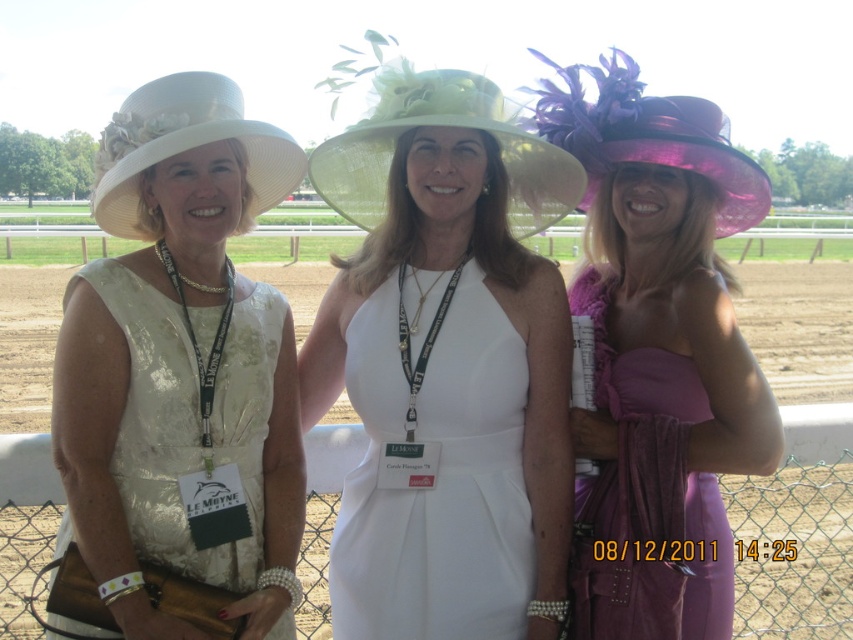
Can you confirm if white straw hat at center is taller than purple velvet dress at right?

Correct, white straw hat at center is much taller as purple velvet dress at right.

What do you see at coordinates (445, 365) in the screenshot? This screenshot has height=640, width=853. I see `white straw hat at center` at bounding box center [445, 365].

Find the location of a particular element. white straw hat at center is located at coordinates (445, 365).

Does white straw hat at center come in front of matte white dress at center?

No, it is not.

Can you confirm if white straw hat at center is positioned above matte white dress at center?

No.

Where is `white straw hat at center`? Image resolution: width=853 pixels, height=640 pixels. white straw hat at center is located at coordinates (x=445, y=365).

Can you confirm if matte white dress at center is taller than brown dirt track at center?

Incorrect, matte white dress at center's height is not larger of brown dirt track at center's.

Between point (257, 464) and point (339, 436), which one is positioned behind?

The point (339, 436) is behind.

This screenshot has width=853, height=640. Find the location of `matte white dress at center`. matte white dress at center is located at coordinates (183, 365).